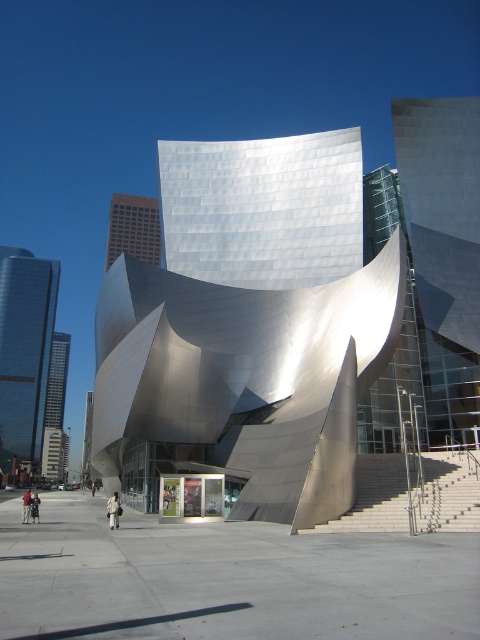
Does point (108, 502) lie behind point (36, 516)?

No, (108, 502) is closer to viewer.

Consider the image. Which is below, light beige fabric bag at center or dark gray fabric jacket at lower left?

Positioned lower is light beige fabric bag at center.

You are a GUI agent. You are given a task and a screenshot of the screen. Output one action in this format:
    pyautogui.click(x=<x>, y=<y>)
    Task: Click on the light beige fabric bag at center
    The height and width of the screenshot is (640, 480).
    Given the screenshot: What is the action you would take?
    pyautogui.click(x=113, y=509)

Where is `light beige fabric bag at center`? The height and width of the screenshot is (640, 480). light beige fabric bag at center is located at coordinates (113, 509).

Describe the element at coordinates (113, 509) in the screenshot. I see `light beige fabric bag at center` at that location.

Which is above, light beige fabric bag at center or light brown leather jacket at center?

light beige fabric bag at center is above.

Which is in front, point (108, 522) or point (27, 500)?

Point (27, 500) is in front.

Find the location of a particular element. light beige fabric bag at center is located at coordinates (113, 509).

Is shiny glass skyscraper at left positioned at the back of light beige fabric bag at center?

That is True.

Consider the image. Does shiny glass skyscraper at left have a larger size compared to light beige fabric bag at center?

Correct, shiny glass skyscraper at left is larger in size than light beige fabric bag at center.

Does point (36, 394) come behind point (118, 499)?

That is True.

This screenshot has height=640, width=480. Find the location of `shiny glass skyscraper at left`. shiny glass skyscraper at left is located at coordinates (24, 349).